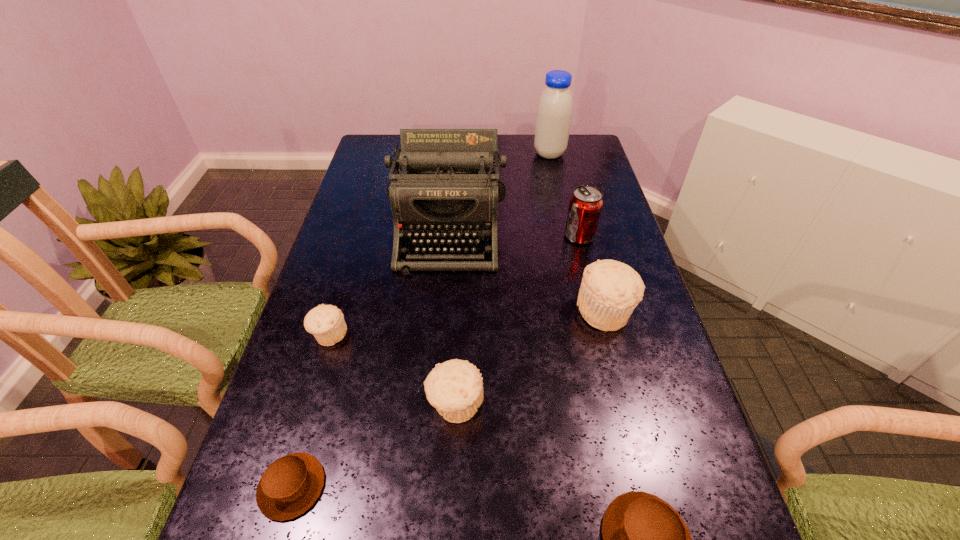
The width and height of the screenshot is (960, 540). Find the location of `pop soda present at the right edge`. pop soda present at the right edge is located at coordinates (586, 202).

You are a GUI agent. You are given a task and a screenshot of the screen. Output one action in this format:
    pyautogui.click(x=<x>, y=<y>)
    Task: Click on the muffin that is positioned at the right edge
    
    Given the screenshot: What is the action you would take?
    pyautogui.click(x=610, y=290)

This screenshot has width=960, height=540. What are the coordinates of `object that is positioned at the far right corner` in the screenshot? It's located at (554, 112).

The image size is (960, 540). In the image, there is a desktop. In order to click on vacant space at the far edge in this screenshot , I will do click(528, 148).

Locate an element on the screen. The height and width of the screenshot is (540, 960). free space at the left edge is located at coordinates (324, 497).

In the image, there is a desktop. Identify the location of vacant space at the right edge. (661, 409).

You are a GUI agent. You are given a task and a screenshot of the screen. Output one action in this format:
    pyautogui.click(x=<x>, y=<y>)
    Task: Click on the vacant space at the far left corner of the desktop
    Image resolution: width=960 pixels, height=540 pixels.
    Given the screenshot: What is the action you would take?
    pyautogui.click(x=363, y=160)

In the image, there is a desktop. Find the location of `free space at the far right corner`. free space at the far right corner is located at coordinates (575, 158).

The width and height of the screenshot is (960, 540). I want to click on free space between the typewriter and the third farthest muffin, so click(452, 316).

At what (x,y) coordinates should I click in order to perform the action: click on free space between the second biggest beige muffin and the pop soda. Please return your answer as a coordinate pair (x, y). Looking at the image, I should click on click(517, 320).